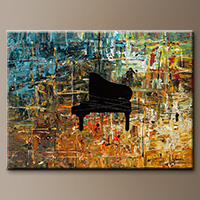
The width and height of the screenshot is (200, 200). Identify the location of art. (145, 125).